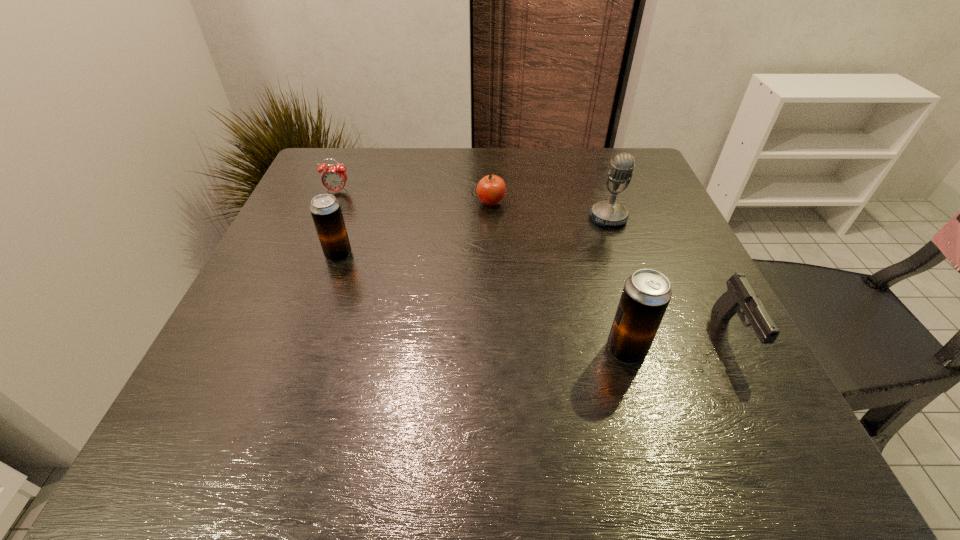
The height and width of the screenshot is (540, 960). In order to click on free space for an extra beer_can to achieve even spacing in this screenshot , I will do `click(468, 297)`.